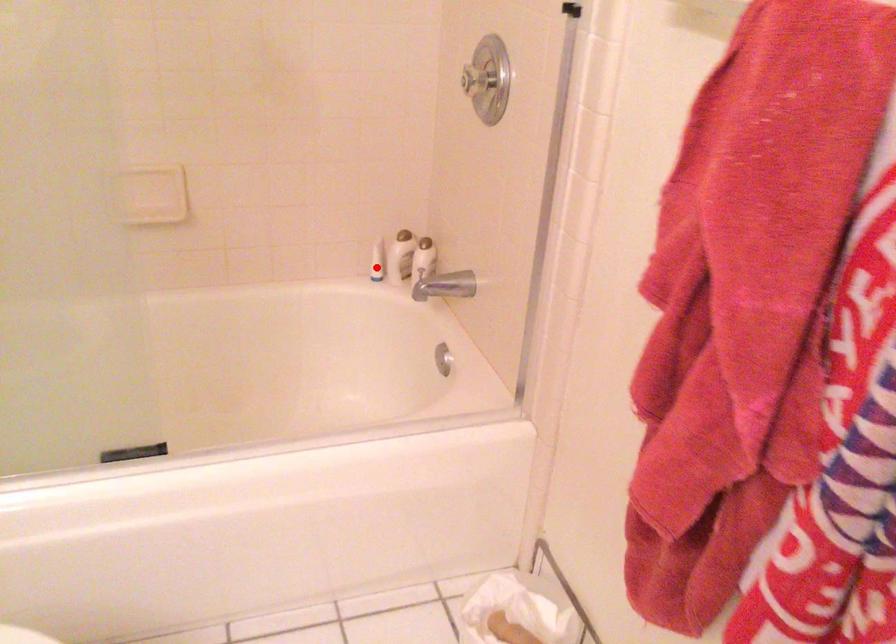
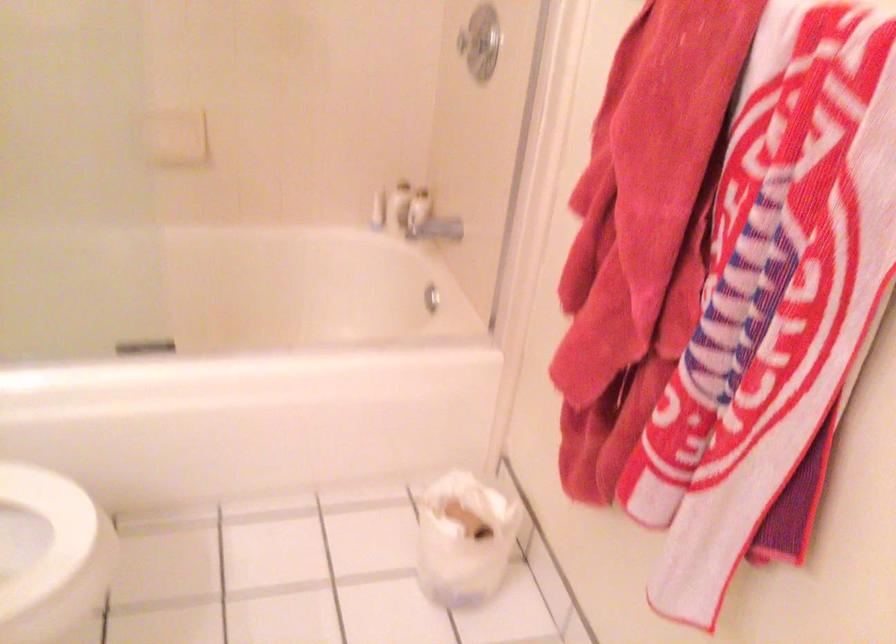
Locate, in the second image, the point that corresponds to the highlighted location in the first image.

(378, 211)